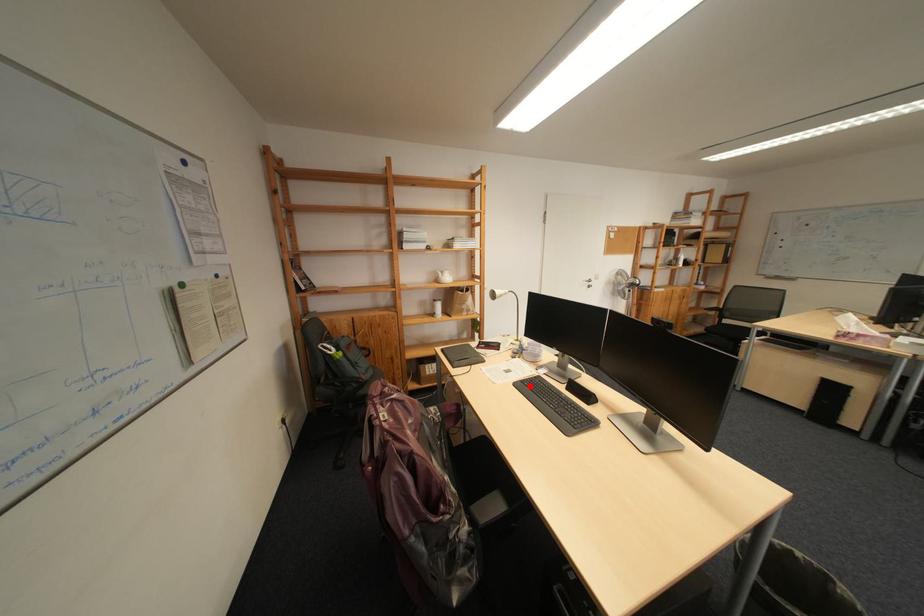
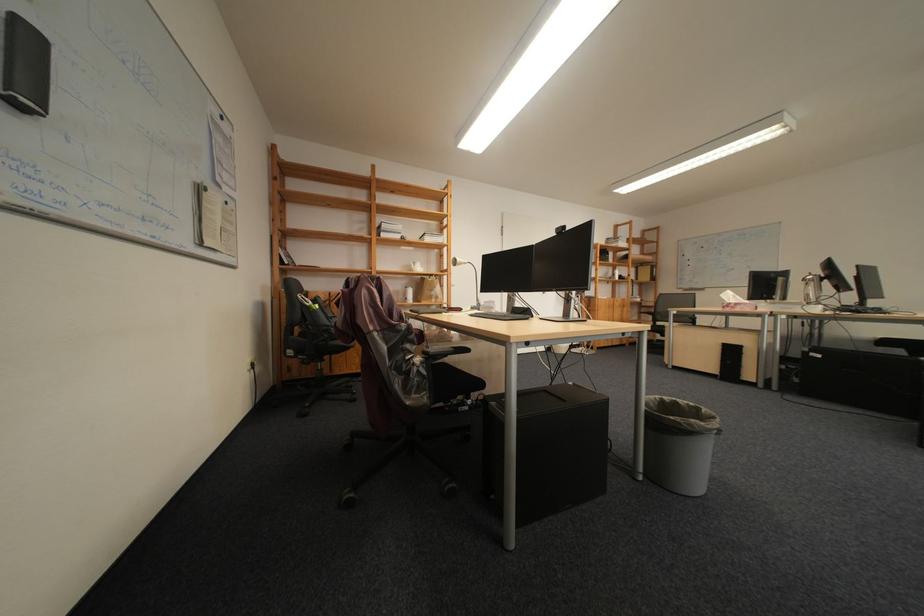
Locate, in the second image, the point that corresponds to the highlighted location in the first image.

(484, 317)